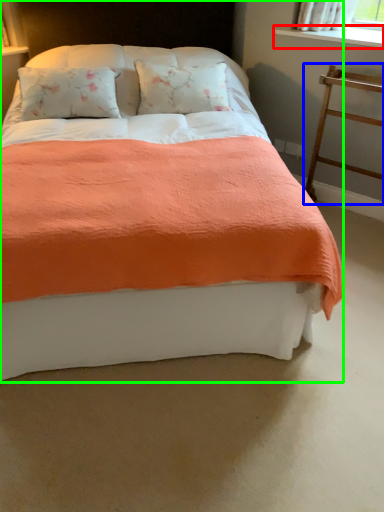
Question: Considering the real-world distances, which object is farthest from window sill (highlighted by a red box)? balustrade (highlighted by a blue box) or bed (highlighted by a green box)?

Choices:
 (A) balustrade
 (B) bed

Answer: (B)